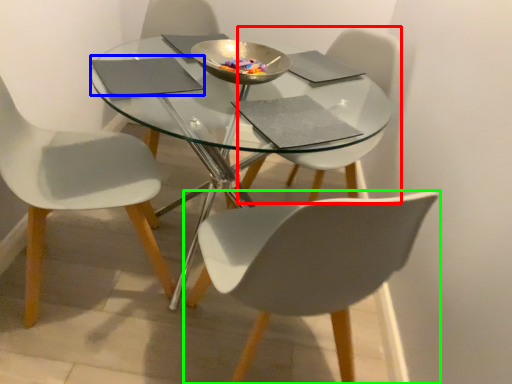
Question: Which object is the closest to the chair (highlighted by a red box)? Choose among these: pad (highlighted by a blue box) or chair (highlighted by a green box).

Choices:
 (A) pad
 (B) chair

Answer: (B)